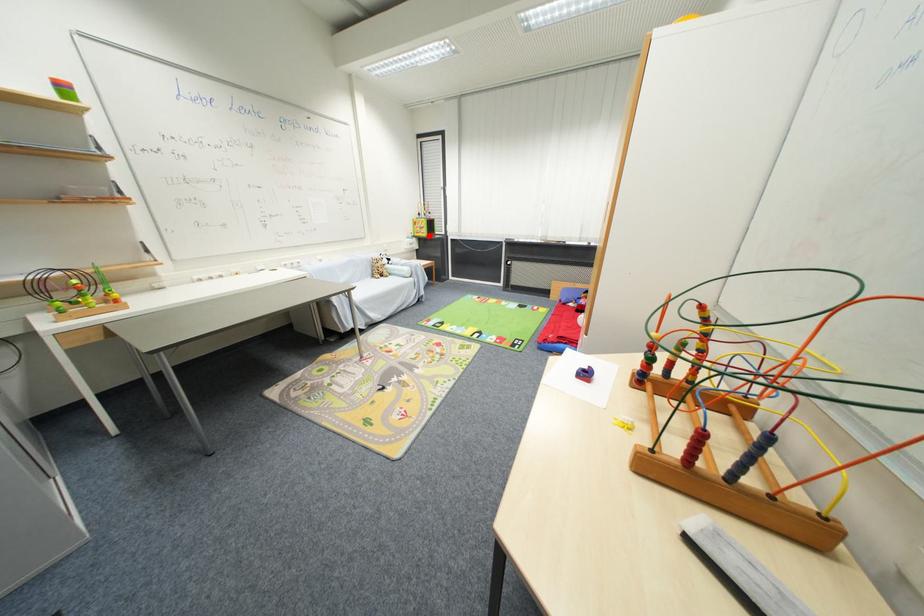
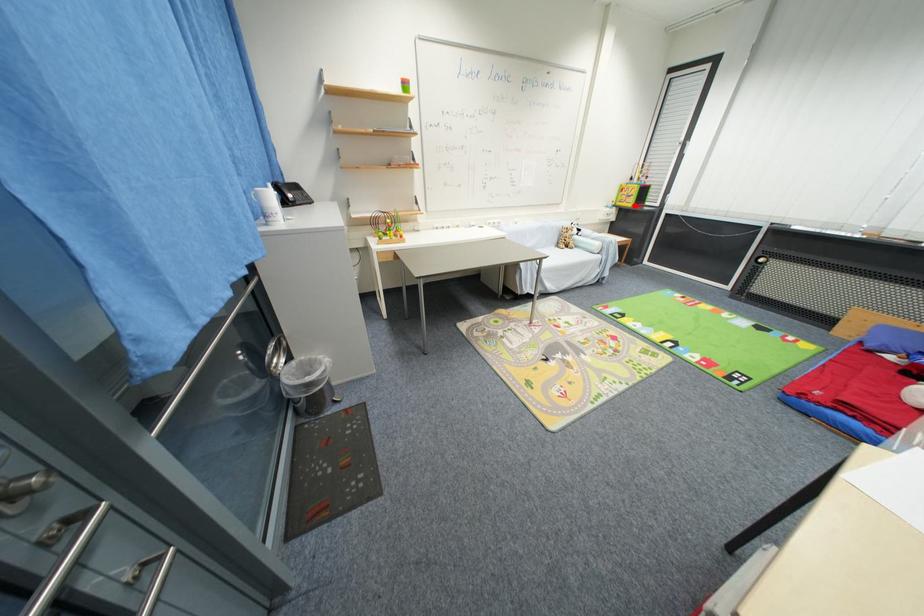
I am providing you with two images of the same scene from different viewpoints. A red point is marked on the first image and another point is marked on the second image. Is the red point in image1 aligned with the point shown in image2?

Yes